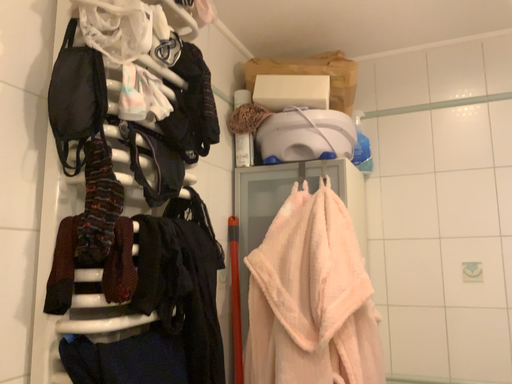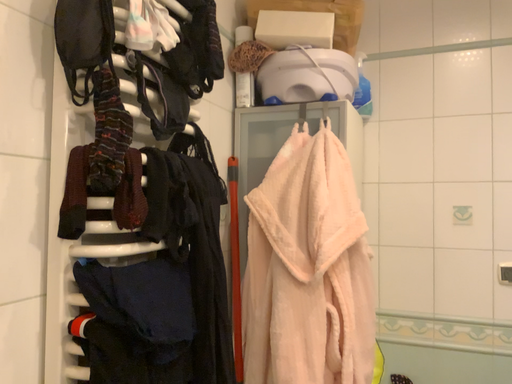
Question: How did the camera likely rotate when shooting the video?

Choices:
 (A) rotated downward
 (B) rotated upward

Answer: (A)